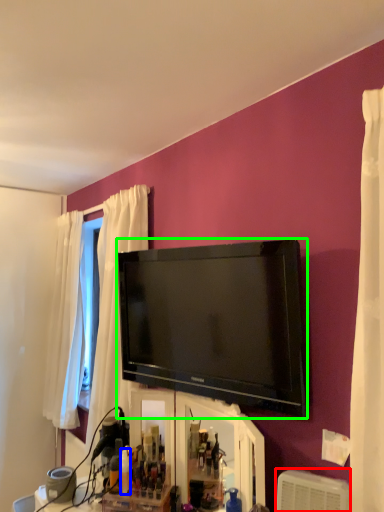
Question: Based on their relative distances, which object is farther from air conditioner (highlighted by a red box)? Choose from toiletry (highlighted by a blue box) and television (highlighted by a green box).

Choices:
 (A) toiletry
 (B) television

Answer: (A)